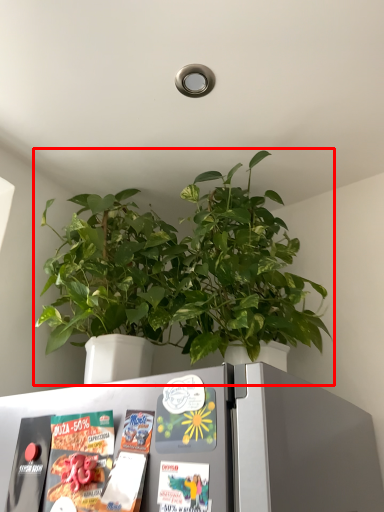
Question: Considering the relative positions of houseplant (annotated by the red box) and refrigerator in the image provided, where is houseplant (annotated by the red box) located with respect to the staircase?

Choices:
 (A) left
 (B) right

Answer: (B)